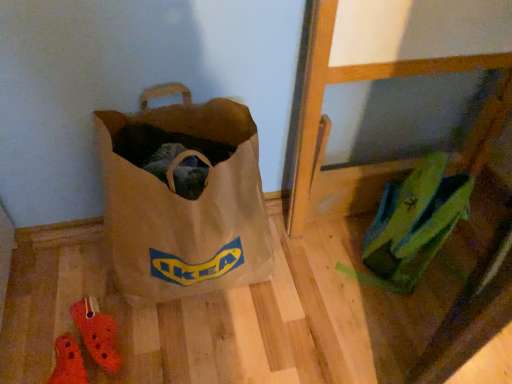
Image resolution: width=512 pixels, height=384 pixels. Find the location of `space that is in front of green fabric backpack at upper right`. space that is in front of green fabric backpack at upper right is located at coordinates (387, 318).